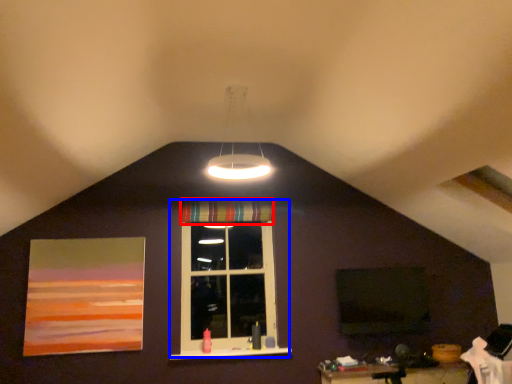
Question: Which of the following is the closest to the observer, curtain (highlighted by a red box) or window (highlighted by a blue box)?

Choices:
 (A) curtain
 (B) window

Answer: (B)